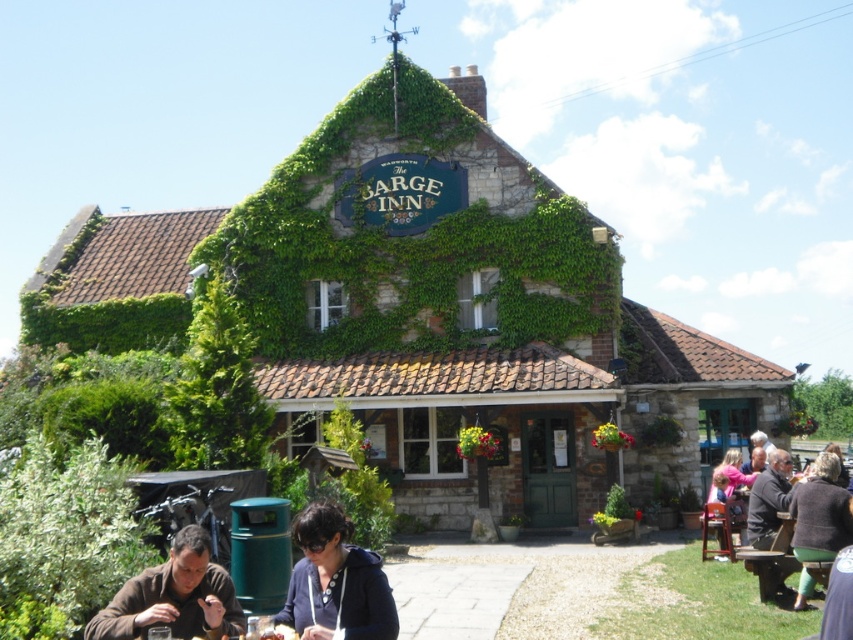
Question: Estimate the real-world distances between objects in this image. Which object is farther from the dark brown woolen sweater at lower right?

Choices:
 (A) dark blue hoodie at center
 (B) brown leather jacket at lower left
 (C) brown wooden picnic table at lower right

Answer: (B)

Question: Among these points, which one is farthest from the camera?

Choices:
 (A) (766, 550)
 (B) (791, 512)

Answer: (A)

Question: Where is dark blue hoodie at center located in relation to brown wooden picnic table at lower right in the image?

Choices:
 (A) left
 (B) right

Answer: (A)

Question: Which point is closer to the camera?

Choices:
 (A) brown wooden picnic table at lower right
 (B) dark brown leather jacket at lower right

Answer: (B)

Question: Can you confirm if dark blue hoodie at center is positioned below dark brown leather jacket at lower right?

Choices:
 (A) no
 (B) yes

Answer: (B)

Question: Is dark blue hoodie at center positioned behind dark brown leather jacket at lower right?

Choices:
 (A) no
 (B) yes

Answer: (A)